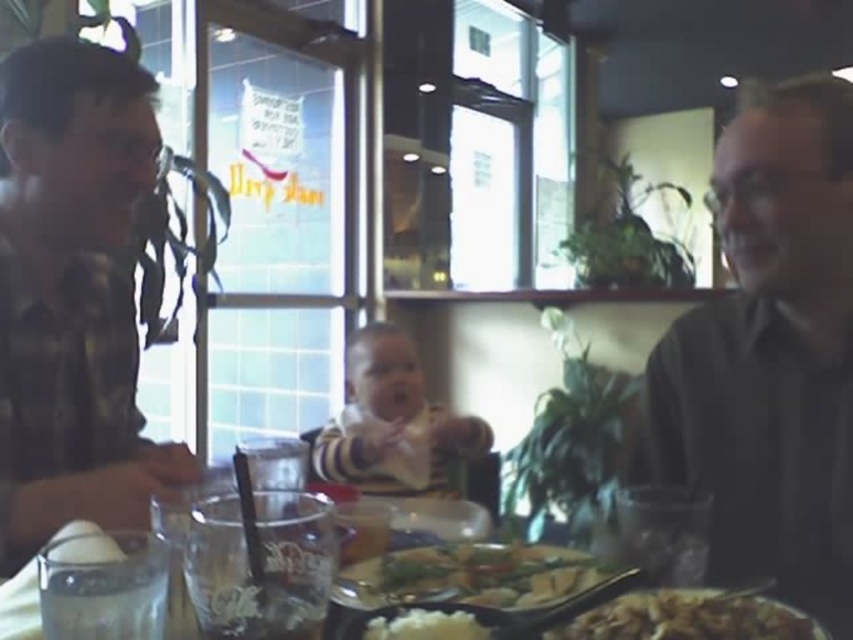
Question: Considering the relative positions of brown crispy fried rice at lower center and clear plastic cups at lower center in the image provided, where is brown crispy fried rice at lower center located with respect to clear plastic cups at lower center?

Choices:
 (A) right
 (B) left

Answer: (A)

Question: Which object is closer to the camera taking this photo?

Choices:
 (A) clear plastic cups at lower center
 (B) dark gray shirt at right
 (C) brown crispy fried rice at lower center

Answer: (C)

Question: Is striped fabric baby at center to the right of shiny silver plate at center from the viewer's perspective?

Choices:
 (A) yes
 (B) no

Answer: (B)

Question: Does clear plastic cups at lower center have a greater width compared to white rice at center?

Choices:
 (A) yes
 (B) no

Answer: (A)

Question: Which point appears closest to the camera in this image?

Choices:
 (A) [384, 632]
 (B) [196, 460]

Answer: (A)

Question: Estimate the real-world distances between objects in this image. Which object is farther from the clear plastic cups at lower center?

Choices:
 (A) plaid flannel shirt at left
 (B) shiny silver plate at center

Answer: (A)